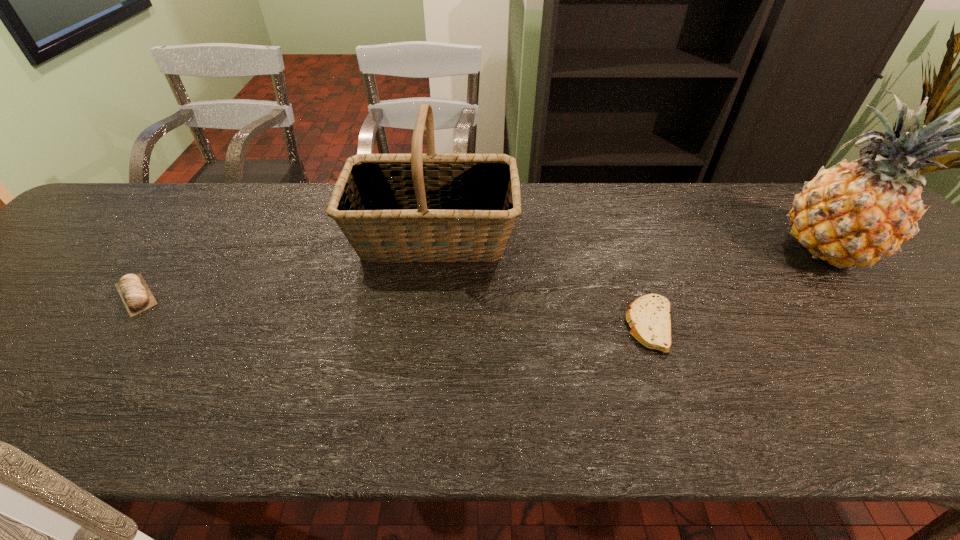
Identify the location of vacant space in between the third tallest object and the right pita bread. 394,310.

Where is `free area in between the second tallest object and the second shortest object`? The height and width of the screenshot is (540, 960). free area in between the second tallest object and the second shortest object is located at coordinates (284, 265).

I want to click on free space between the third shortest object and the shorter pita bread, so (541, 281).

This screenshot has width=960, height=540. Find the location of `free area in between the tallest object and the right pita bread`. free area in between the tallest object and the right pita bread is located at coordinates click(740, 288).

Locate an element on the screen. free space between the rightmost object and the shorter pita bread is located at coordinates (740, 288).

This screenshot has height=540, width=960. Identify the location of vacant point located between the rightmost object and the second object from left to right. (631, 243).

This screenshot has width=960, height=540. Find the location of `vacant space in between the shorter pita bread and the taller pita bread`. vacant space in between the shorter pita bread and the taller pita bread is located at coordinates (394, 310).

The height and width of the screenshot is (540, 960). Identify the location of free spot between the left pita bread and the second tallest object. (284, 265).

Where is `free space between the third object from right to left and the right pita bread`? This screenshot has height=540, width=960. free space between the third object from right to left and the right pita bread is located at coordinates (541, 281).

Choose which object is the second nearest neighbor to the third object from left to right. Please provide its 2D coordinates. Your answer should be formatted as a tuple, i.e. [(x, y)], where the tuple contains the x and y coordinates of a point satisfying the conditions above.

[(854, 213)]